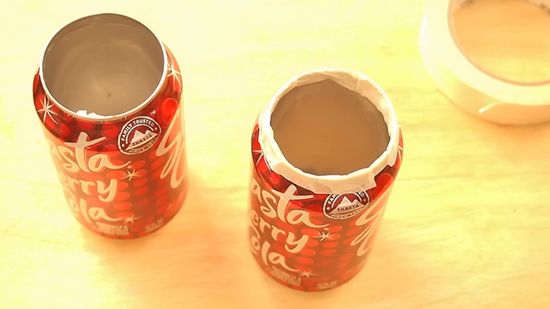
What are the coordinates of `candle wax` in the screenshot? It's located at (337, 148), (116, 69).